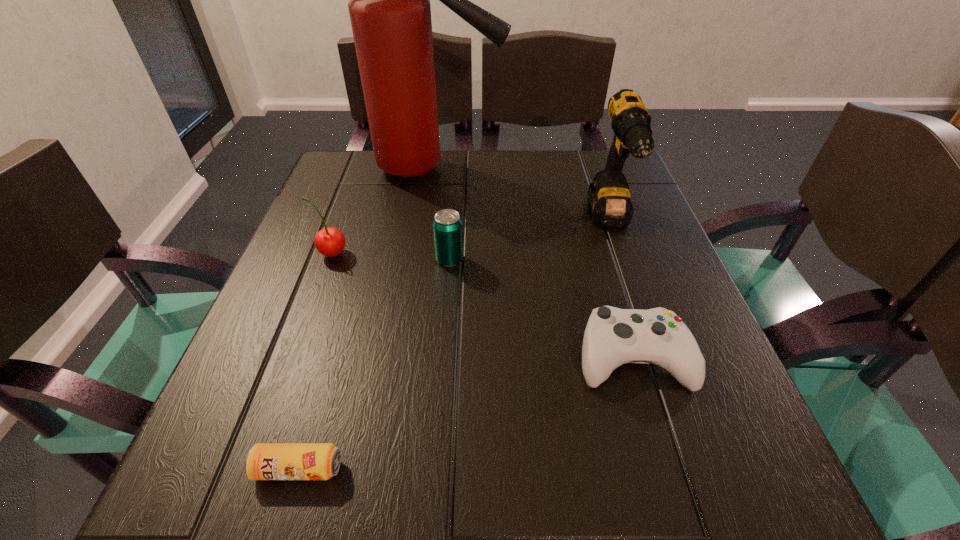
Locate an element on the screen. The width and height of the screenshot is (960, 540). blank region between the second tallest object and the fire extinguisher is located at coordinates (518, 195).

What are the coordinates of `object that is the third closest to the drill` in the screenshot? It's located at (447, 225).

Where is `object that stands as the fourth closest to the nearer beer can`? The width and height of the screenshot is (960, 540). object that stands as the fourth closest to the nearer beer can is located at coordinates (608, 197).

I want to click on vacant area that satisfies the following two spatial constraints: 1. on the back side of the nearest object; 2. on the right side of the taller beer can, so click(x=360, y=260).